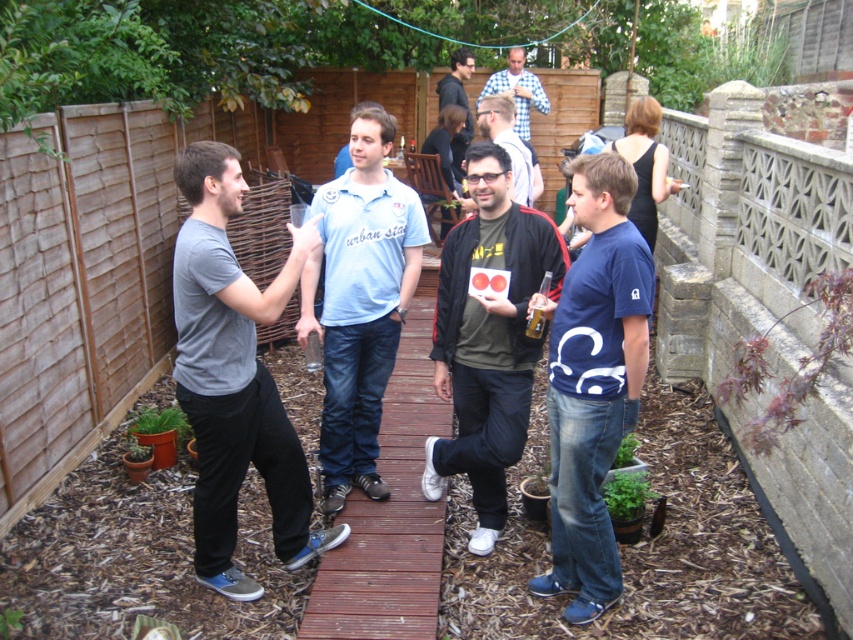
Consider the image. Which is more to the right, blue cotton t-shirt at center or matte black jacket at center?

blue cotton t-shirt at center

Between point (527, 586) and point (509, 145), which one is positioned in front?

Point (527, 586) is in front.

What are the coordinates of `blue cotton t-shirt at center` in the screenshot? It's located at (595, 381).

Does brown wooden fence at left appear over matte gray t-shirt at center?

Correct, brown wooden fence at left is located above matte gray t-shirt at center.

Locate an element on the screen. brown wooden fence at left is located at coordinates point(86,276).

Identify the location of brown wooden fence at left. The image size is (853, 640). (86, 276).

Which is below, light blue cotton shirt at center or wooden deck at center?

wooden deck at center is below.

Which is behind, point (376, 298) or point (431, 320)?

Point (431, 320)

Where is `light blue cotton shirt at center`? light blue cotton shirt at center is located at coordinates (360, 301).

Find the location of a particular element. The image size is (853, 640). light blue cotton shirt at center is located at coordinates (360, 301).